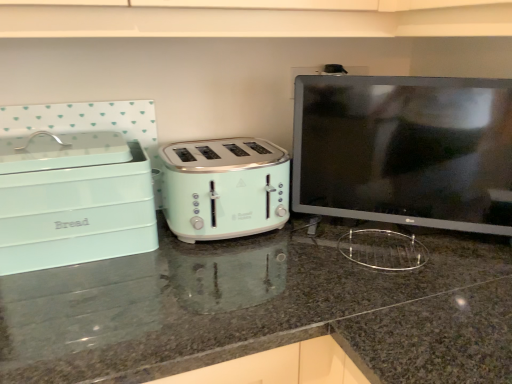
Question: Is mint green plastic toaster at center surrounded by matte green toaster at center?

Choices:
 (A) yes
 (B) no

Answer: (A)

Question: Is matte green toaster at center at the right side of mint green plastic toaster at center?

Choices:
 (A) yes
 (B) no

Answer: (A)

Question: Does matte green toaster at center have a smaller size compared to mint green plastic toaster at center?

Choices:
 (A) yes
 (B) no

Answer: (B)

Question: Can you confirm if matte green toaster at center is taller than mint green plastic toaster at center?

Choices:
 (A) yes
 (B) no

Answer: (A)

Question: From a real-world perspective, is matte green toaster at center over mint green plastic toaster at center?

Choices:
 (A) yes
 (B) no

Answer: (B)

Question: Is matte green toaster at center at the left side of mint green plastic toaster at center?

Choices:
 (A) yes
 (B) no

Answer: (B)

Question: Does mint green plastic toaster at center have a greater height compared to mint green plastic bread bin at left?

Choices:
 (A) no
 (B) yes

Answer: (A)

Question: Is mint green plastic toaster at center wider than mint green plastic bread bin at left?

Choices:
 (A) no
 (B) yes

Answer: (A)

Question: Does mint green plastic toaster at center lie in front of mint green plastic bread bin at left?

Choices:
 (A) yes
 (B) no

Answer: (B)

Question: Is mint green plastic toaster at center to the right of mint green plastic bread bin at left from the viewer's perspective?

Choices:
 (A) yes
 (B) no

Answer: (A)

Question: Are mint green plastic toaster at center and mint green plastic bread bin at left far apart?

Choices:
 (A) yes
 (B) no

Answer: (B)

Question: From the image's perspective, is mint green plastic toaster at center located beneath mint green plastic bread bin at left?

Choices:
 (A) no
 (B) yes

Answer: (A)

Question: From a real-world perspective, is mint green plastic toaster at center positioned under matte black monitor at right based on gravity?

Choices:
 (A) no
 (B) yes

Answer: (B)